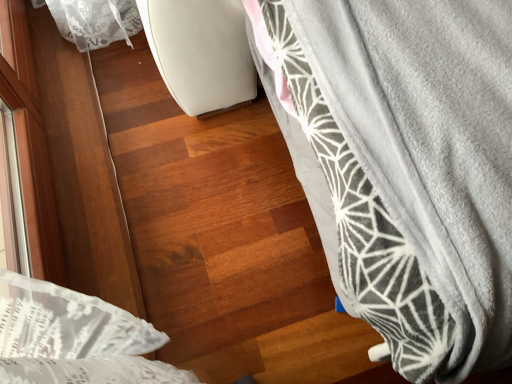
Question: Should I look upward or downward to see gray fleece blanket at right?

Choices:
 (A) down
 (B) up

Answer: (B)